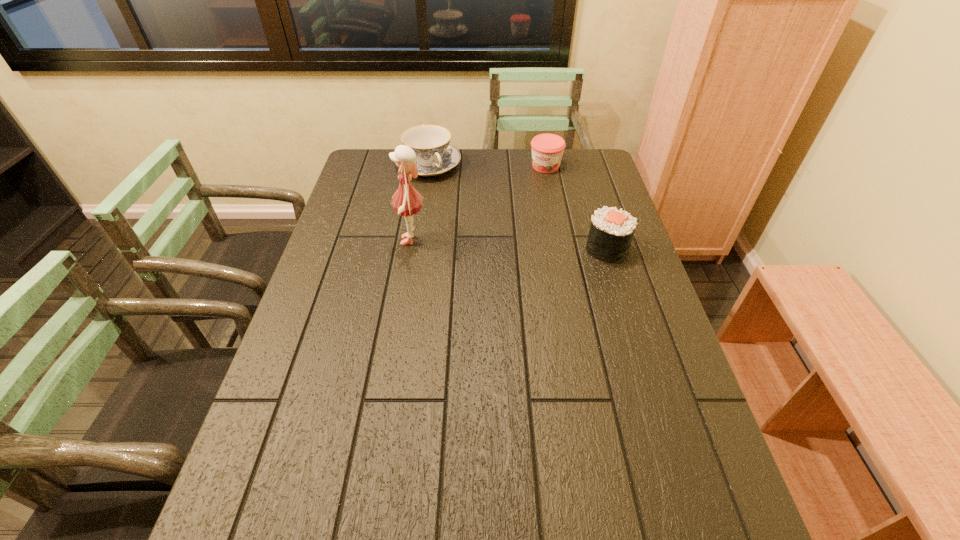
This screenshot has height=540, width=960. Find the location of `vacant space on the desktop that is between the tallest object and the rightmost object and is positioned on the front label of the shortest object`. vacant space on the desktop that is between the tallest object and the rightmost object and is positioned on the front label of the shortest object is located at coordinates coord(503,244).

At what (x,y) coordinates should I click in order to perform the action: click on free space on the desktop that is between the tallest object and the rightmost object and is positioned with the handle on the side of the chinaware. Please return your answer as a coordinate pair (x, y). Looking at the image, I should click on [501, 244].